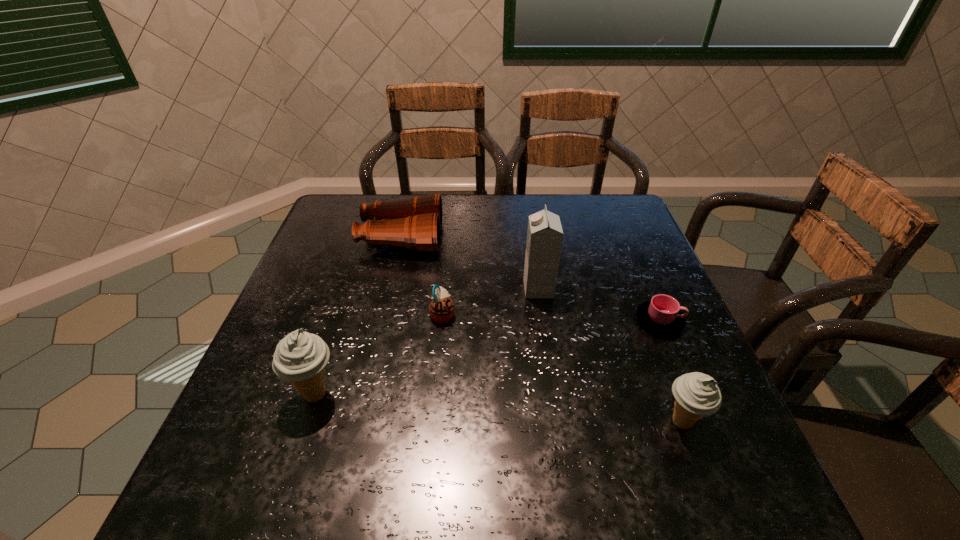
Find the location of a particular element. Image resolution: width=960 pixels, height=540 pixels. vacant space positioned on the back of the taller icecream is located at coordinates (347, 299).

The height and width of the screenshot is (540, 960). I want to click on vacant space located 0.180m on the left of the fourth shortest object, so click(x=564, y=422).

Locate an element on the screen. free point located on the front label of the third object from right to left is located at coordinates pos(376,289).

Where is `vacant area situated on the front label of the third object from right to left`? vacant area situated on the front label of the third object from right to left is located at coordinates (472, 289).

This screenshot has height=540, width=960. Find the location of `vacant area situated 0.240m on the front label of the third object from right to left`. vacant area situated 0.240m on the front label of the third object from right to left is located at coordinates (428, 289).

You are a GUI agent. You are given a task and a screenshot of the screen. Output one action in this format:
    pyautogui.click(x=<x>, y=<y>)
    Task: Click on the free location located 0.130m through the lenses of the farthest object
    
    Given the screenshot: What is the action you would take?
    pyautogui.click(x=486, y=238)

Locate an element on the screen. free space located on the front-facing side of the muffin is located at coordinates (549, 314).

Locate an element on the screen. object that is at the far edge is located at coordinates (415, 223).

Where is `icecream situated at the left edge`? icecream situated at the left edge is located at coordinates (300, 358).

This screenshot has width=960, height=540. Find the location of `binoculars at the left edge`. binoculars at the left edge is located at coordinates (415, 223).